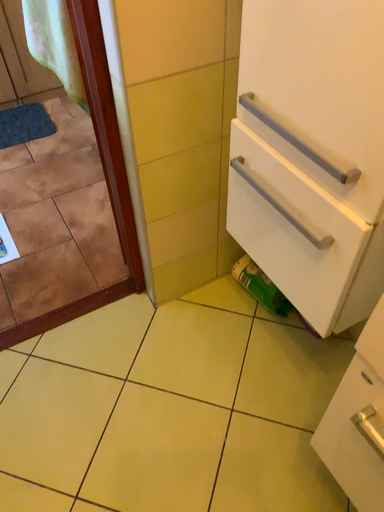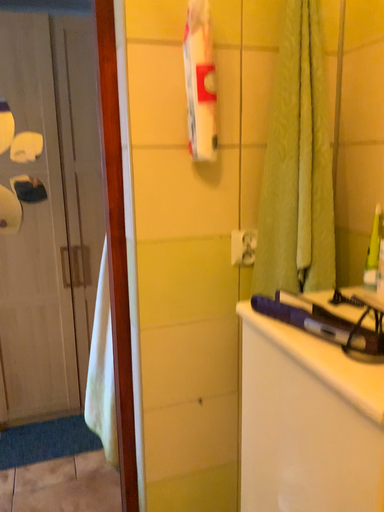
Question: How did the camera likely rotate when shooting the video?

Choices:
 (A) rotated downward
 (B) rotated upward

Answer: (B)